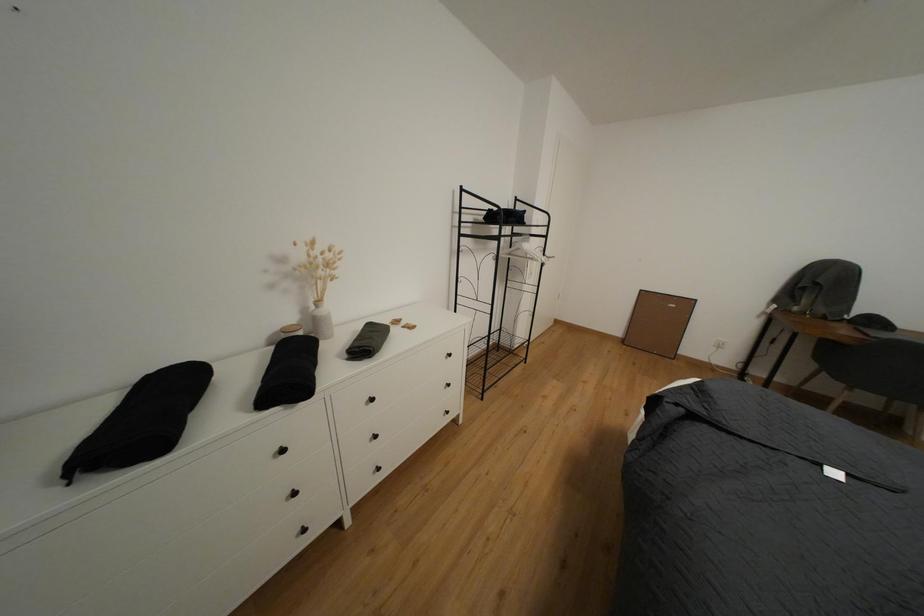
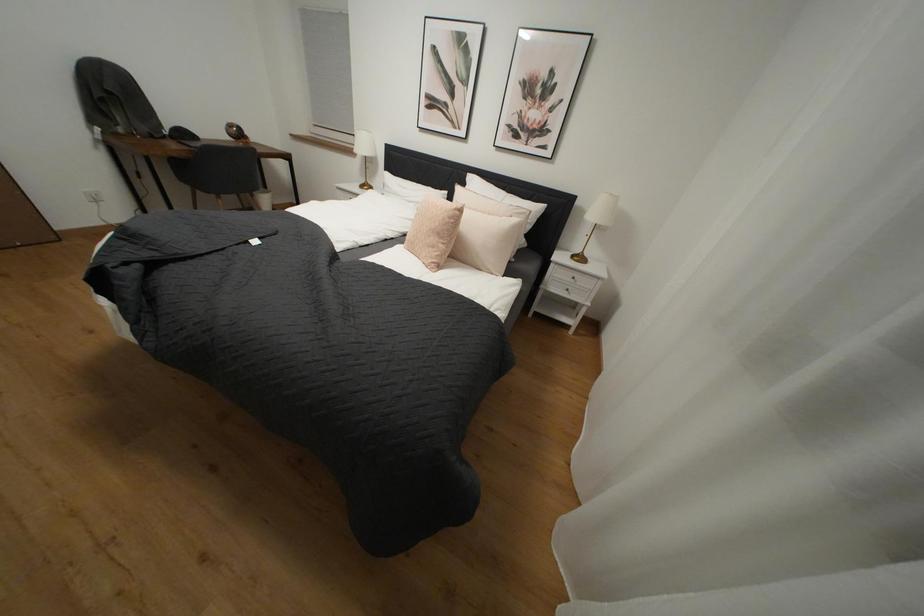
How did the camera likely rotate?

The camera's rotation is toward right-down.